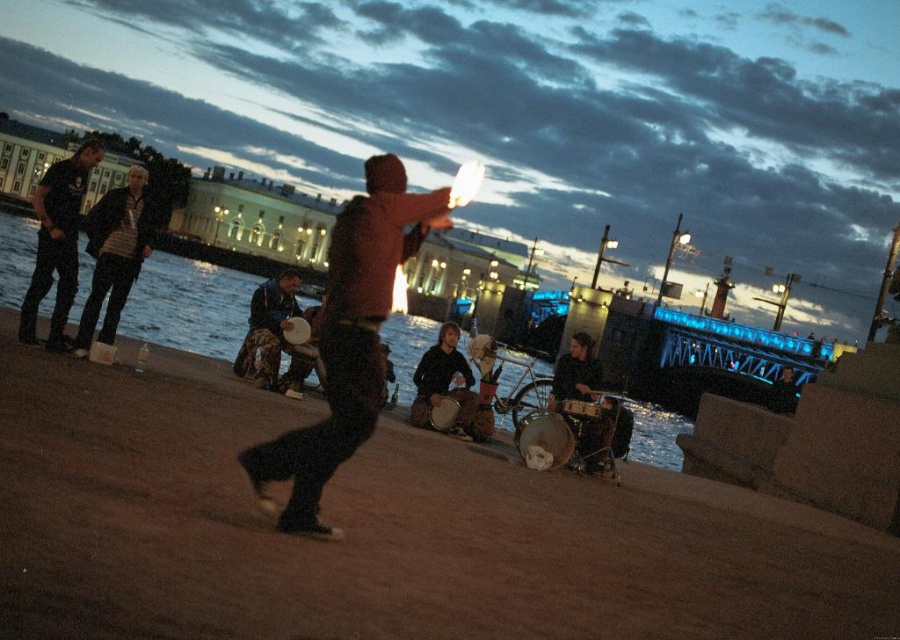
You are a photographer trying to capture the dark brown leather jacket at center in your shot. The camera you are using has a focal length of 50mm and an aperture of f2.8. Based on the scene description, where should you position the camera to ensure the jacket is centered in the frame?

The dark brown leather jacket at center is already positioned at the center of the scene at coordinates point (x=348, y=339), so positioning the camera directly facing the center will ensure the jacket is centered in the frame.

You are a photographer setting up a tripod in this scene. You need to position it so that it doesn not block the view of the dark jeans at left and the smooth wooden drum at lower center. Given their heights, which object might require you to adjust the tripod height to ensure both are visible?

The dark jeans at left has a greater height compared to the smooth wooden drum at lower center. Therefore, you should adjust the tripod height to accommodate the taller dark jeans at left to ensure both are visible.